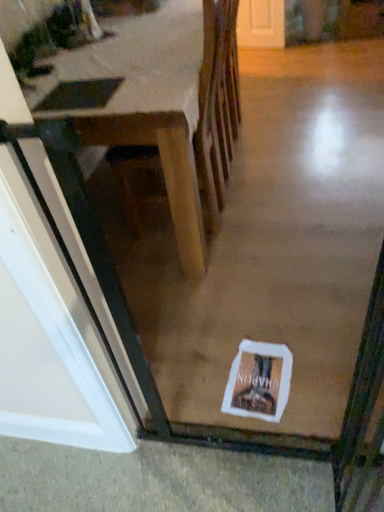
Locate an element on the screen. This screenshot has height=512, width=384. space that is in front of white paper postcard at center is located at coordinates (279, 425).